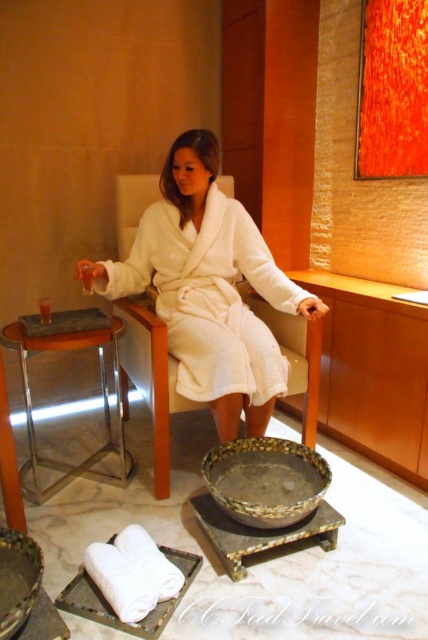
Is rustic ceramic bowl at lower center bigger than metallic silver stool at left?

No.

Can you confirm if rustic ceramic bowl at lower center is thinner than metallic silver stool at left?

Correct, rustic ceramic bowl at lower center's width is less than metallic silver stool at left's.

Between point (306, 460) and point (47, 486), which one is positioned behind?

The point (47, 486) is behind.

This screenshot has height=640, width=428. I want to click on rustic ceramic bowl at lower center, so click(x=265, y=481).

Does point (211, 486) lie behind point (190, 563)?

Yes.

Who is more forward, (267, 465) or (76, 586)?

Point (76, 586)

You are a GUI agent. You are given a task and a screenshot of the screen. Output one action in this format:
    pyautogui.click(x=<x>, y=<y>)
    Task: Click on the rustic ceramic bowl at lower center
    The height and width of the screenshot is (640, 428).
    Given the screenshot: What is the action you would take?
    pyautogui.click(x=265, y=481)

From the picture: Between white soft robe at center and matte black tray at left, which one appears on the right side from the viewer's perspective?

Positioned to the right is white soft robe at center.

Is white soft robe at center smaller than matte black tray at left?

Actually, white soft robe at center might be larger than matte black tray at left.

Is point (219, 208) positioned before point (20, 321)?

No, (219, 208) is further to viewer.

Where is `white soft robe at center`? The height and width of the screenshot is (640, 428). white soft robe at center is located at coordinates (208, 289).